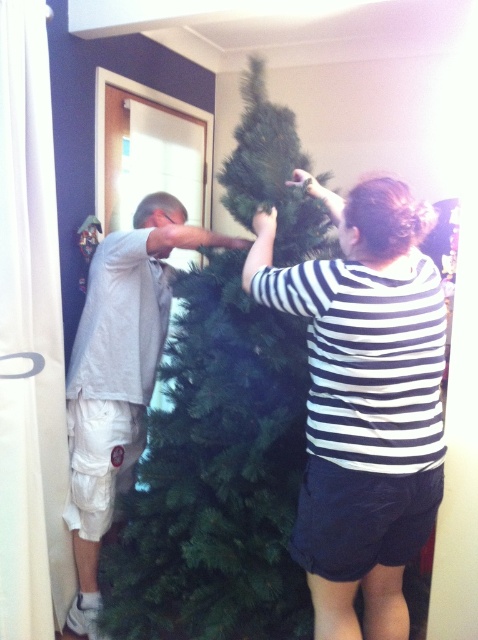
Consider the image. Which is above, striped shirt at center or light gray t-shirt at left?

striped shirt at center

Can you confirm if striped shirt at center is thinner than light gray t-shirt at left?

Yes, striped shirt at center is thinner than light gray t-shirt at left.

This screenshot has height=640, width=478. Identify the location of striped shirt at center. (364, 401).

Is point (300, 426) more distant than point (365, 579)?

That is True.

Between point (262, 72) and point (314, 333), which one is positioned behind?

The point (262, 72) is more distant.

You are a GUI agent. You are given a task and a screenshot of the screen. Output one action in this format:
    pyautogui.click(x=<x>, y=<y>)
    Task: Click on the green artificial christmas tree at center
    This screenshot has height=640, width=478.
    Given the screenshot: What is the action you would take?
    pyautogui.click(x=217, y=476)

Is green artificial christmas tree at center to the right of light gray t-shirt at left from the viewer's perspective?

Yes, green artificial christmas tree at center is to the right of light gray t-shirt at left.

Who is taller, green artificial christmas tree at center or light gray t-shirt at left?

green artificial christmas tree at center

Is point (319, 208) in front of point (182, 205)?

Yes, it is.

At what (x,y) coordinates should I click in order to perform the action: click on green artificial christmas tree at center. Please return your answer as a coordinate pair (x, y). The height and width of the screenshot is (640, 478). Looking at the image, I should click on (217, 476).